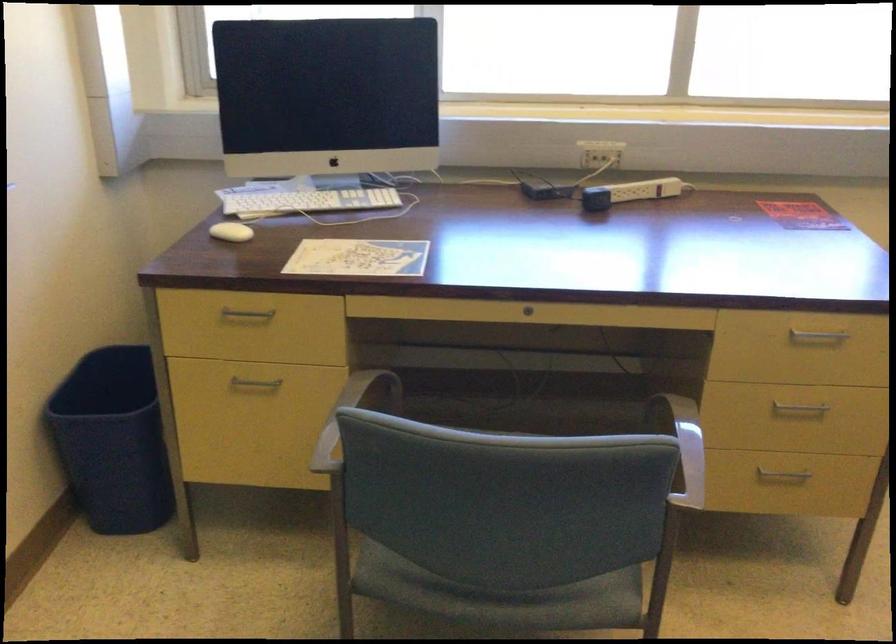
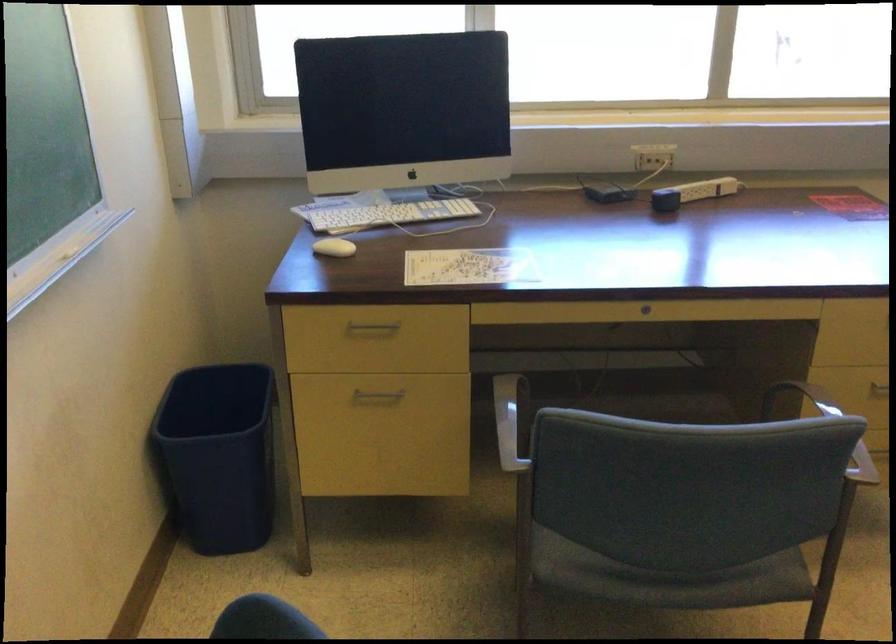
The point at (259,386) is marked in the first image. Where is the corresponding point in the second image?

(376, 395)